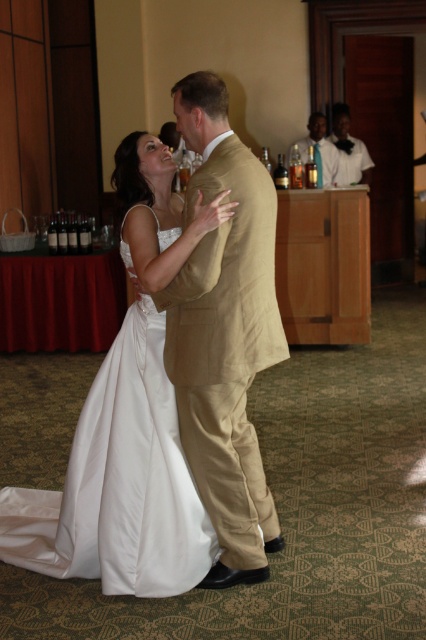
Question: From the image, what is the correct spatial relationship of tan fabric suit at center in relation to matte gold suit at upper center?

Choices:
 (A) right
 (B) left

Answer: (B)

Question: Does tan fabric suit at center appear on the left side of matte gold suit at upper center?

Choices:
 (A) no
 (B) yes

Answer: (B)

Question: Which of the following is the farthest from the observer?

Choices:
 (A) (69, 504)
 (B) (227, 340)
 (C) (325, 170)

Answer: (C)

Question: Is satin white dress at center positioned at the back of matte gold suit at upper center?

Choices:
 (A) yes
 (B) no

Answer: (B)

Question: Which object is closer to the camera taking this photo?

Choices:
 (A) tan fabric suit at center
 (B) matte gold suit at upper center
 (C) satin white dress at center

Answer: (C)

Question: Which object is the farthest from the satin white dress at center?

Choices:
 (A) matte gold suit at upper center
 (B) tan fabric suit at center

Answer: (A)